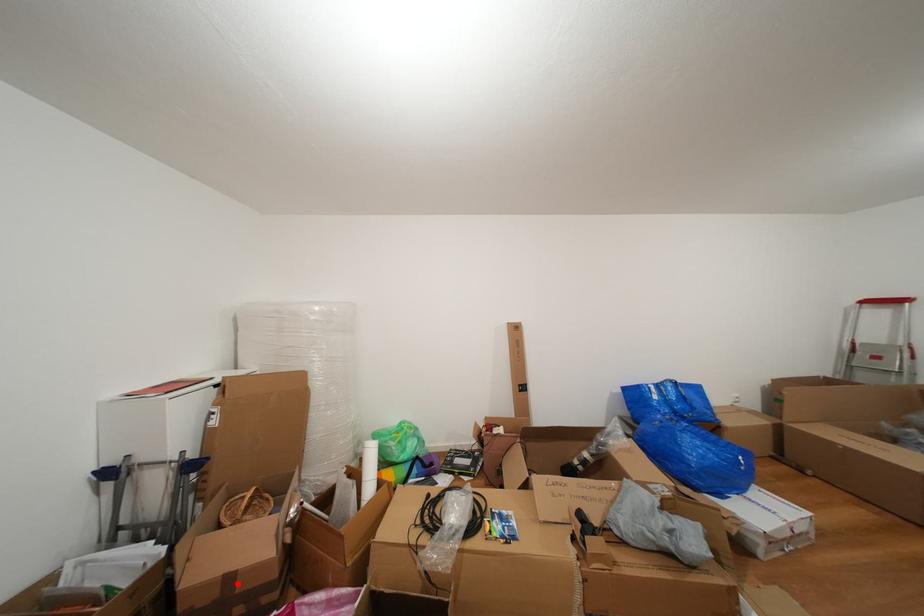
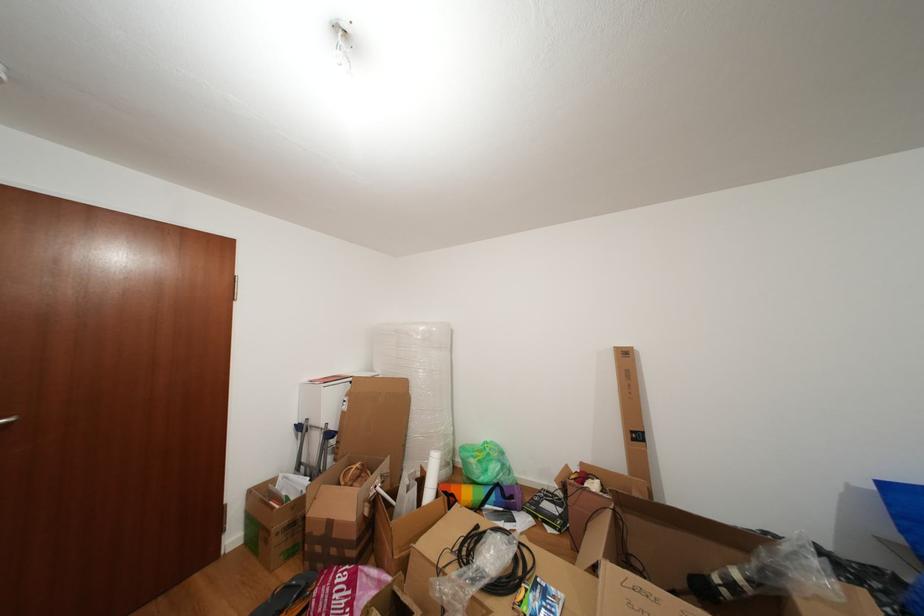
Where in the second image is the point corresponding to the highlighted location from the first image?

(338, 529)